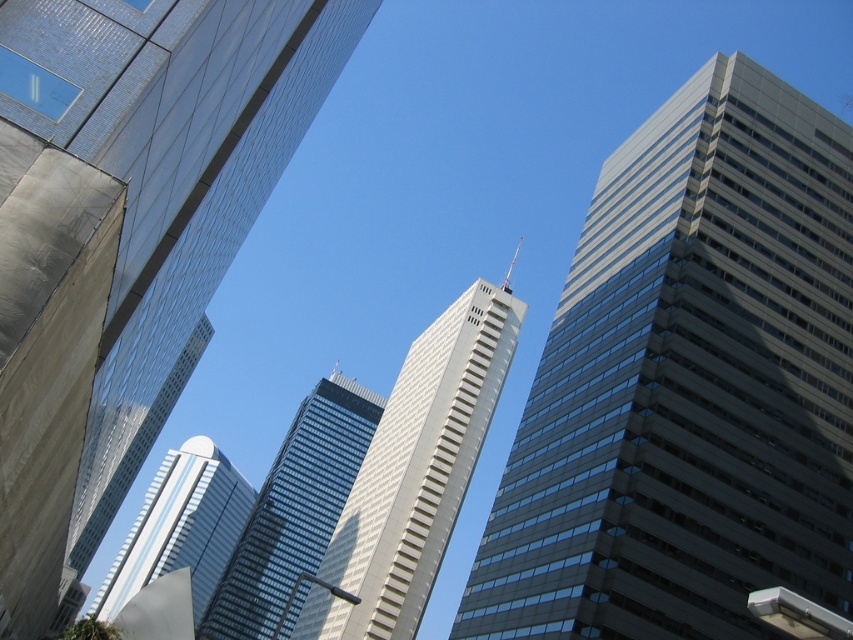
Question: From the image, what is the correct spatial relationship of gray glass skyscraper at upper right in relation to glassy reflective skyscraper at lower left?

Choices:
 (A) above
 (B) below

Answer: (A)

Question: Among these points, which one is nearest to the camera?

Choices:
 (A) (231, 636)
 (B) (112, 472)
 (C) (202, 609)
 (D) (648, 412)

Answer: (D)

Question: Is glassy steel skyscraper at upper center wider than glassy reflective skyscraper at lower left?

Choices:
 (A) no
 (B) yes

Answer: (A)

Question: Which object is farther from the camera taking this photo?

Choices:
 (A) gray glass skyscraper at center
 (B) glassy steel skyscraper at upper center

Answer: (A)

Question: Is gray glass skyscraper at upper right positioned at the back of gray glass skyscraper at center?

Choices:
 (A) no
 (B) yes

Answer: (A)

Question: Which point is farther to the camera?

Choices:
 (A) glassy steel skyscraper at upper center
 (B) gray glass skyscraper at center
 (C) gray glass skyscraper at upper right

Answer: (B)